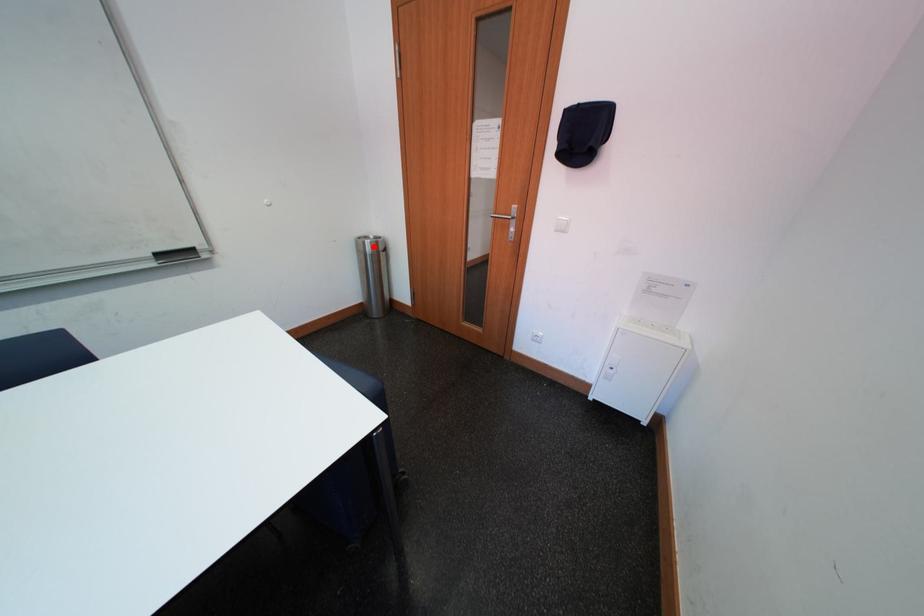
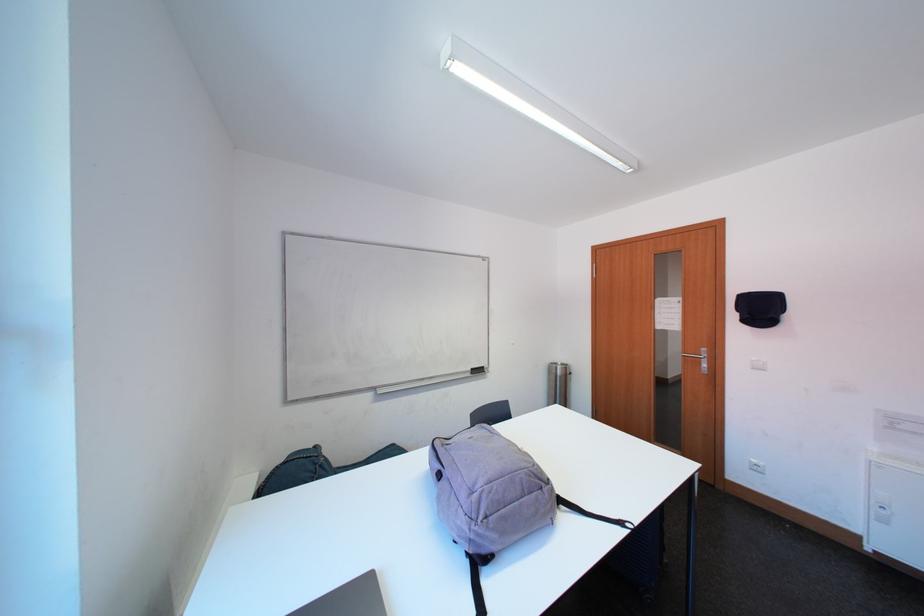
The point at the highlighted location is marked in the first image. Where is the corresponding point in the second image?

(565, 371)